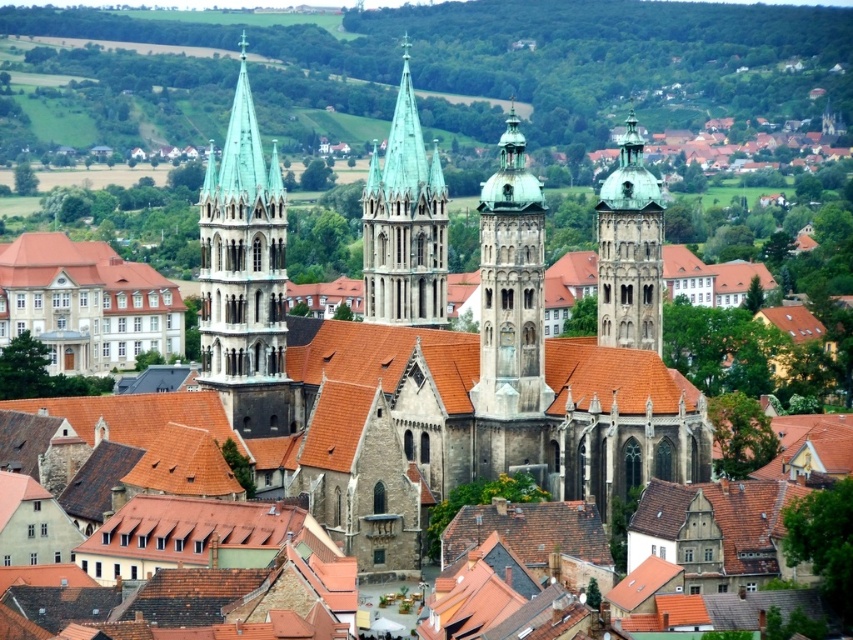
Question: Can you confirm if stone tower at center is positioned to the right of green copper spire at center?

Choices:
 (A) no
 (B) yes

Answer: (B)

Question: Which point appears farthest from the camera in this image?

Choices:
 (A) (235, 336)
 (B) (384, 241)

Answer: (B)

Question: Which point is farther to the camera?

Choices:
 (A) green stone tower at left
 (B) green stone tower at center
 (C) green copper spire at center

Answer: (C)

Question: Is stone tower at center to the right of green copper spire at center from the viewer's perspective?

Choices:
 (A) no
 (B) yes

Answer: (B)

Question: Considering the real-world distances, which object is closest to the green stone tower at center?

Choices:
 (A) green copper spire at center
 (B) stone tower at center

Answer: (B)

Question: Is stone tower at center to the right of green stone tower at center from the viewer's perspective?

Choices:
 (A) no
 (B) yes

Answer: (A)